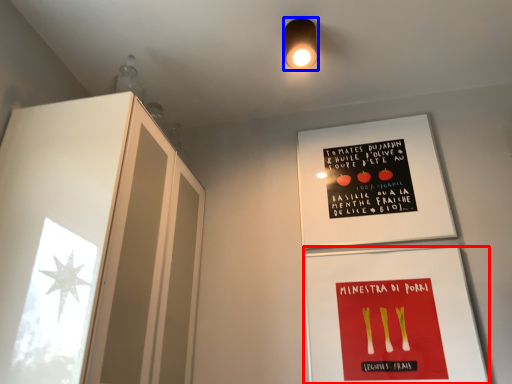
Question: Which object is further to the camera taking this photo, flyer (highlighted by a red box) or light fixture (highlighted by a blue box)?

Choices:
 (A) flyer
 (B) light fixture

Answer: (B)